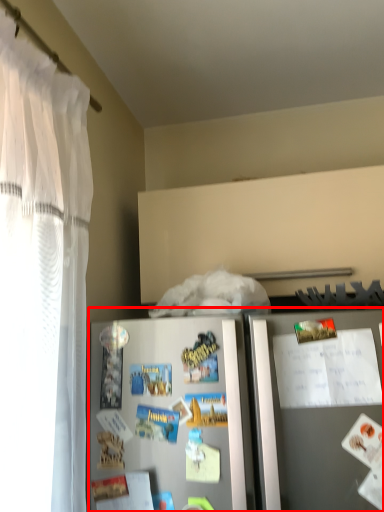
Question: From the image's perspective, considering the relative positions of refrigerator (annotated by the red box) and comic book in the image provided, where is refrigerator (annotated by the red box) located with respect to the staircase?

Choices:
 (A) below
 (B) above

Answer: (A)